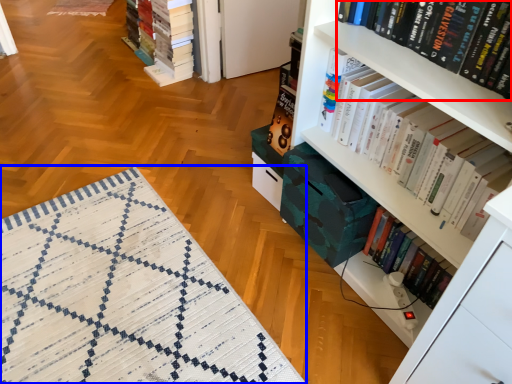
Question: Which point is closer to the camera, book (highlighted by a red box) or mat (highlighted by a blue box)?

Choices:
 (A) book
 (B) mat

Answer: (A)